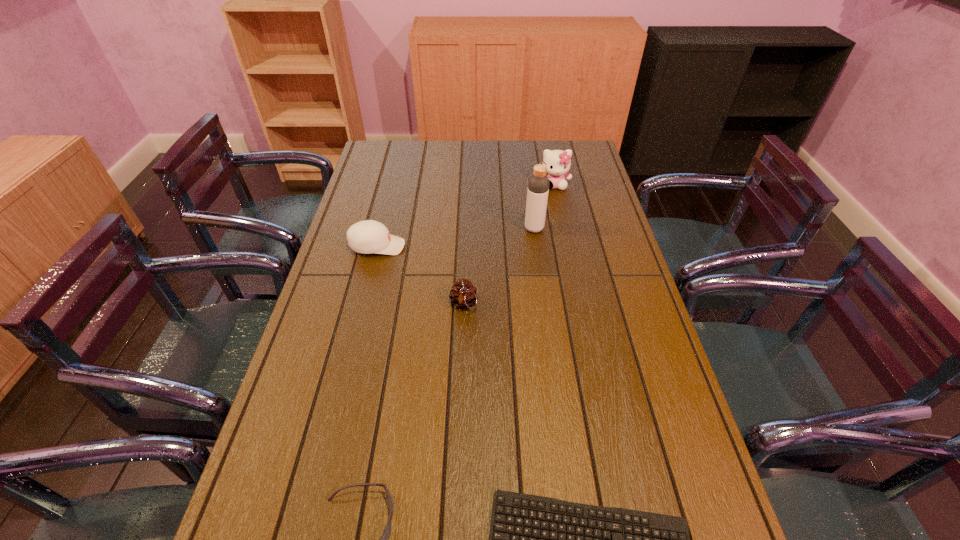
Find the location of a particular element. This screenshot has width=960, height=540. vacant space that satisfies the following two spatial constraints: 1. on the front-facing side of the fifth shortest object; 2. on the front-facing side of the baseball cap is located at coordinates (567, 246).